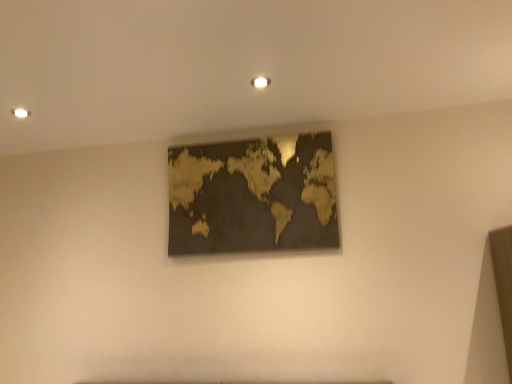
Describe the element at coordinates (253, 196) in the screenshot. I see `wooden map at center` at that location.

In order to click on wooden map at center in this screenshot , I will do `click(253, 196)`.

Where is `wooden map at center`? wooden map at center is located at coordinates (253, 196).